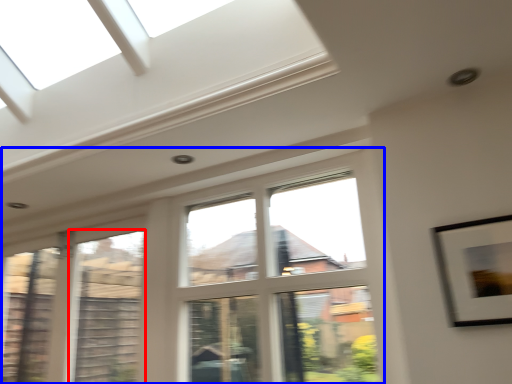
Question: Which point is further to the camera, window (highlighted by a red box) or window (highlighted by a blue box)?

Choices:
 (A) window
 (B) window

Answer: (A)